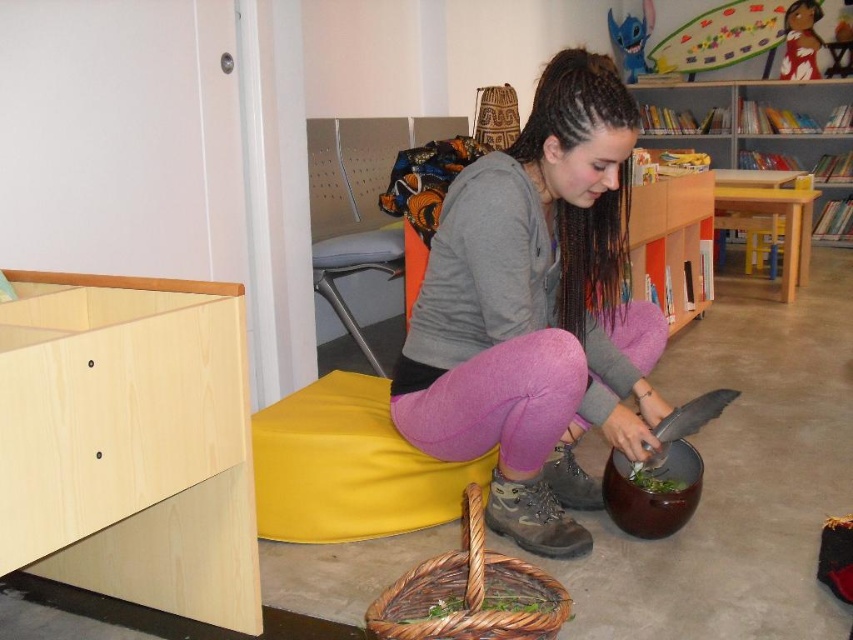
Which of these two, smooth plastic doll at upper right or blue plush toy at upper center, stands taller?

blue plush toy at upper center

Which is behind, point (785, 44) or point (636, 72)?

Positioned behind is point (636, 72).

Find the location of a particular element. This screenshot has height=640, width=853. smooth plastic doll at upper right is located at coordinates (801, 42).

Between wooden bookshelf at upper right and leather at lower center, which one has less height?

leather at lower center

Is wooden bookshelf at upper right smaller than leather at lower center?

Actually, wooden bookshelf at upper right might be larger than leather at lower center.

Where is `wooden bookshelf at upper right`? The image size is (853, 640). wooden bookshelf at upper right is located at coordinates coord(757,125).

Does brown leather shoe at lower center lie behind smooth plastic doll at upper right?

No, brown leather shoe at lower center is in front of smooth plastic doll at upper right.

Does brown leather shoe at lower center have a greater width compared to smooth plastic doll at upper right?

Correct, the width of brown leather shoe at lower center exceeds that of smooth plastic doll at upper right.

Does point (532, 480) come in front of point (796, 56)?

Yes.

The image size is (853, 640). In order to click on brown leather shoe at lower center in this screenshot , I will do `click(532, 516)`.